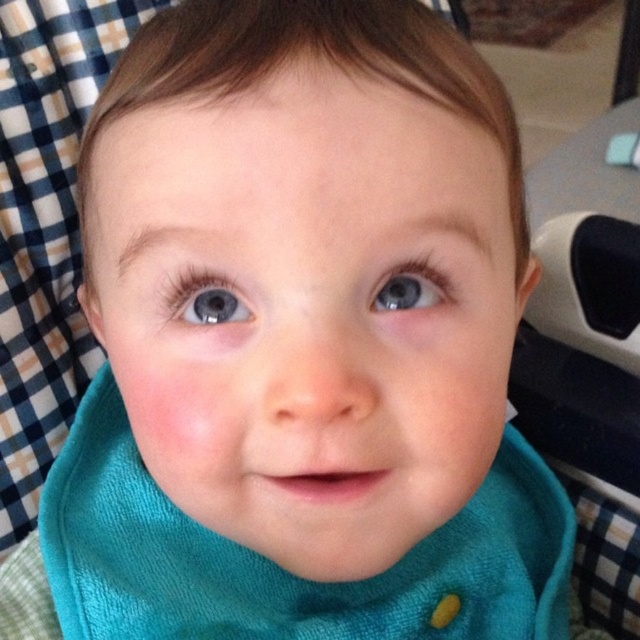
You are a photographer trying to capture the baby in the image. You want to focus on the blue glossy eye at upper center while ensuring the teal soft fabric bib at center is still visible in the frame. Is the position of the bib below the eye suitable for this composition?

The teal soft fabric bib at center is located below the blue glossy eye at upper center, so yes, the bib will be visible in the frame while focusing on the blue glossy eye at upper center.

From the picture: You are a photographer taking a portrait of the baby. You need to adjust the lighting so that the teal soft fabric bib at center and the blue glossy eye at center are both well lit. Since one object is taller than the other, which one might require a larger spotlight to ensure proper illumination?

The teal soft fabric bib at center is taller than the blue glossy eye at center, so it would require a larger spotlight to ensure proper illumination.